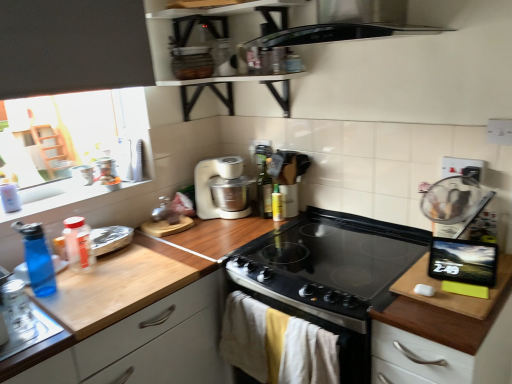
The image size is (512, 384). What are the coordinates of `free space to the right of translucent plastic bottle at left, arranged as the second bottle when viewed from the front` in the screenshot? It's located at (142, 257).